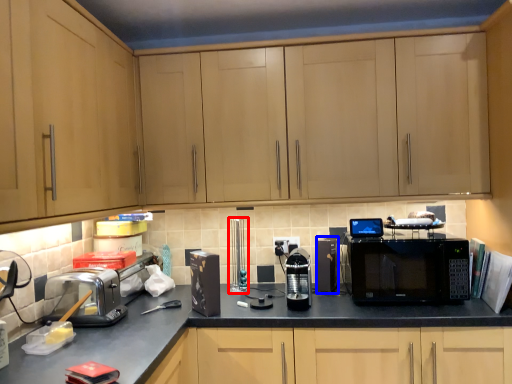
Question: Among these objects, which one is nearest to the camera, appliance (highlighted by a red box) or appliance (highlighted by a blue box)?

Choices:
 (A) appliance
 (B) appliance

Answer: (B)